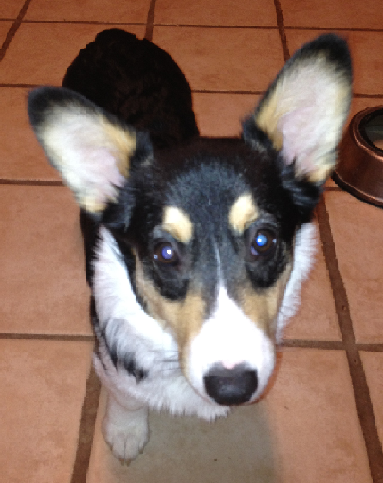
Identify the location of food bowl. (356, 160).